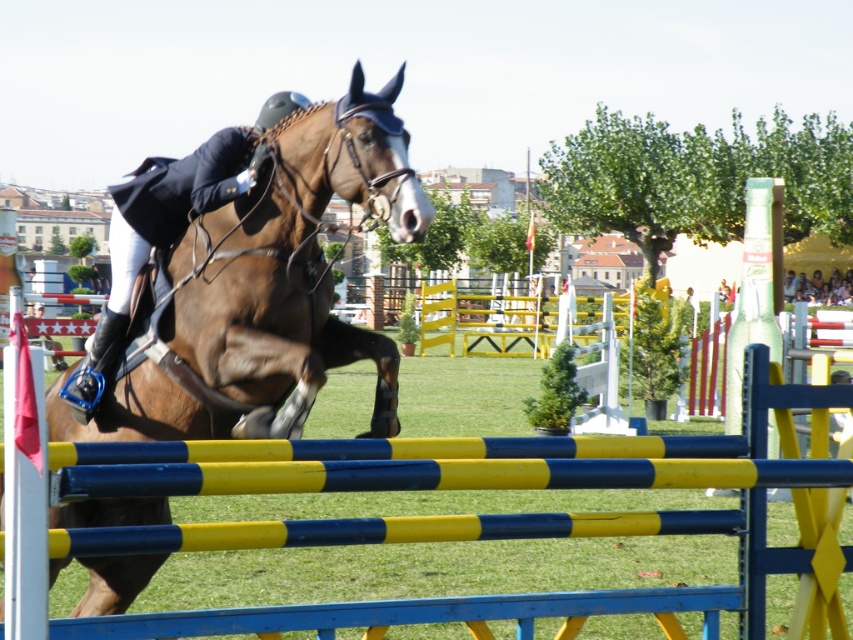
Question: In this image, where is brown glossy horse at center located relative to shiny black jacket at center?

Choices:
 (A) above
 (B) below

Answer: (B)

Question: Which point appears farthest from the camera in this image?

Choices:
 (A) (305, 100)
 (B) (851, 275)
 (C) (544, 467)

Answer: (B)

Question: Which of the following is the farthest from the observer?

Choices:
 (A) (186, 630)
 (B) (178, 214)

Answer: (B)

Question: Can you confirm if blue/yellow striped hurdle at center is positioned below light blue denim jacket at upper center?

Choices:
 (A) yes
 (B) no

Answer: (A)

Question: Which point is farther to the camera?

Choices:
 (A) blue/yellow striped hurdle at center
 (B) brown glossy horse at center

Answer: (B)

Question: Does brown glossy horse at center have a lesser width compared to light blue denim jacket at upper center?

Choices:
 (A) no
 (B) yes

Answer: (B)